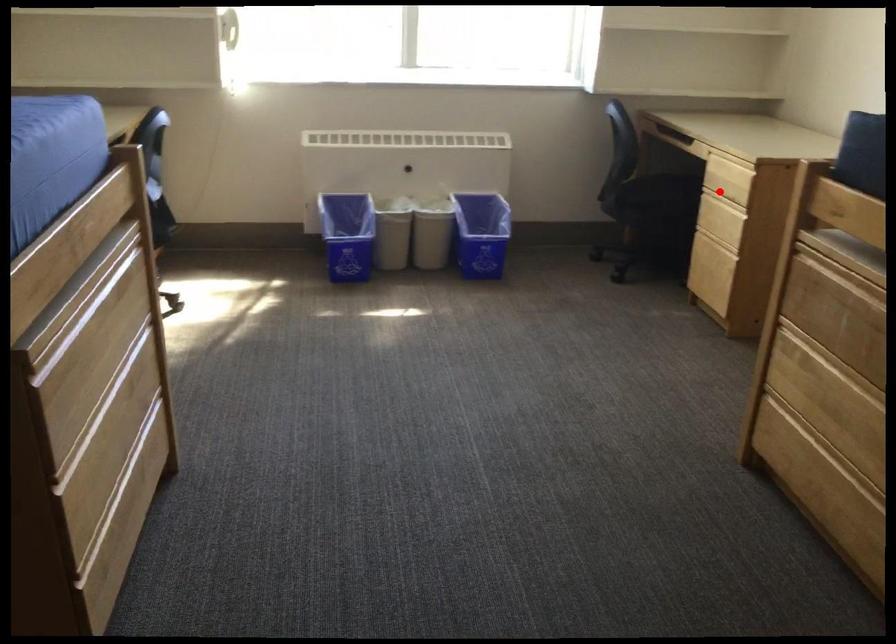
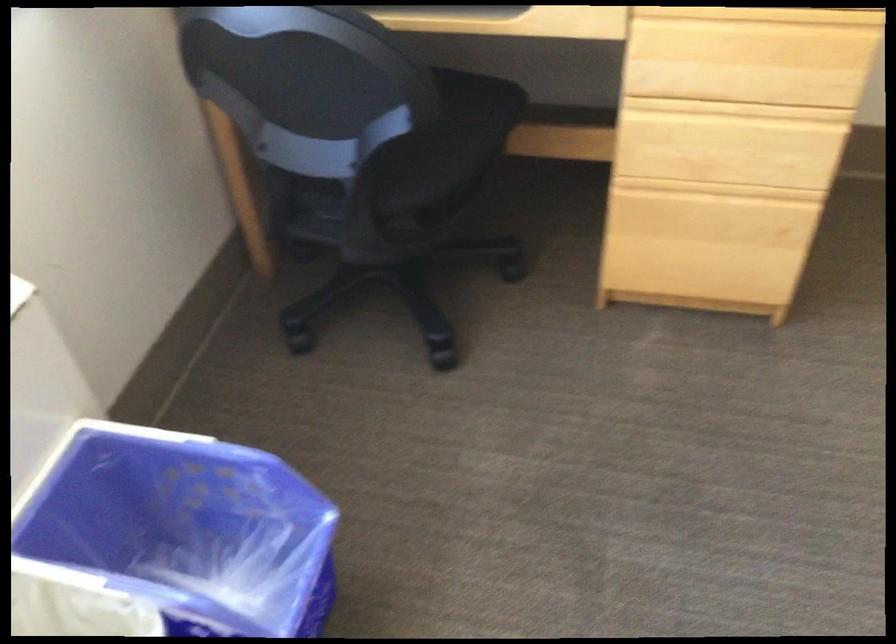
Question: I am providing you with two images of the same scene from different viewpoints. Given a red point in image1, look at the same physical point in image2. Is it:

Choices:
 (A) Closer to the viewpoint
 (B) Farther from the viewpoint

Answer: (A)